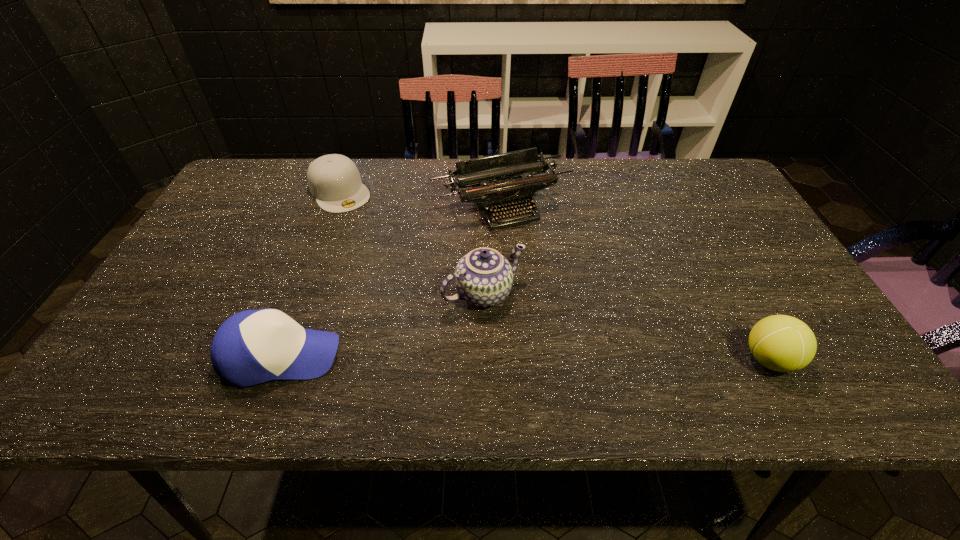
The height and width of the screenshot is (540, 960). Find the location of `blank area in the image that satisfies the following two spatial constraints: 1. on the front side of the cap; 2. on the right side of the typewriter`. blank area in the image that satisfies the following two spatial constraints: 1. on the front side of the cap; 2. on the right side of the typewriter is located at coordinates (334, 207).